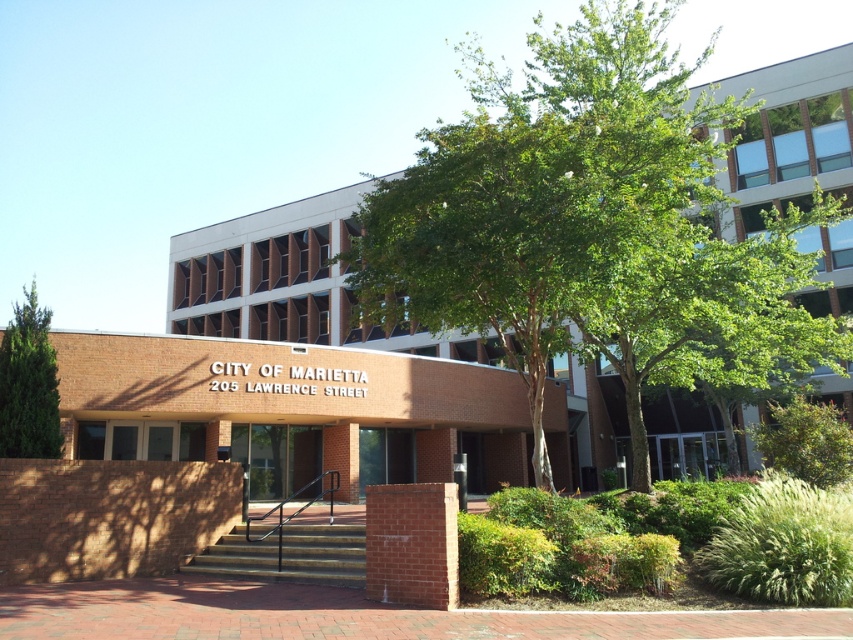
You are a visitor approaching the City of Marietta building and notice two green leafy trees. Which tree, the green leafy tree at center or the green leafy tree at left, is larger in size?

The green leafy tree at center is bigger than the green leafy tree at left.

You are standing in front of the City of Marietta building and want to locate two specific points marked on the facade. The first point is at coordinate point (503, 333) and the second is at point (3, 417). Which of these points is closer to your current position?

Point (503, 333) is further to the viewer than point (3, 417), so the point closer to your current position is point (3, 417).